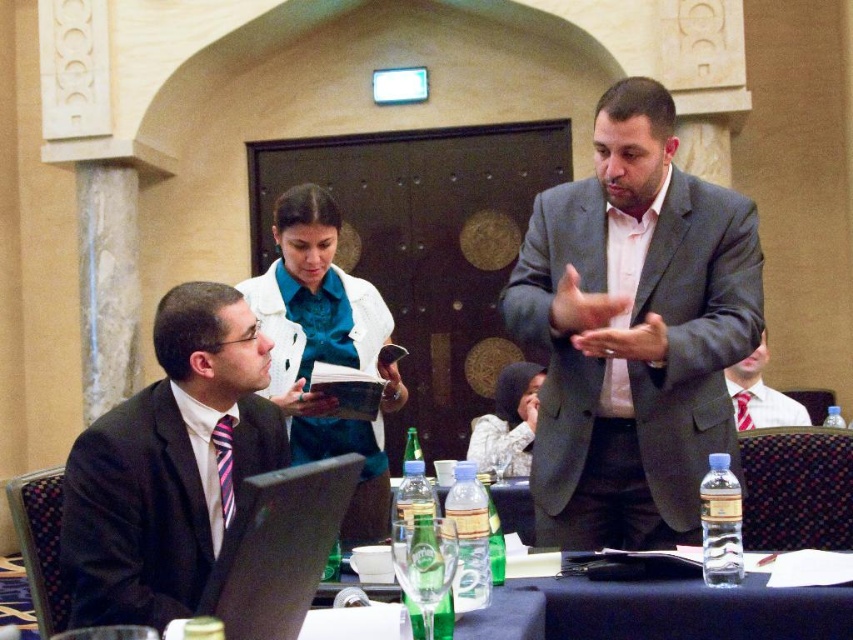
Which of these two, teal fabric book at center or matte gray suit at center, stands shorter?

With less height is matte gray suit at center.

Which is in front, point (283, 195) or point (733, 404)?

Point (283, 195) is more forward.

Who is more forward, (370, 362) or (761, 419)?

Point (370, 362) is in front.

I want to click on teal fabric book at center, so click(x=325, y=348).

Does point (367, 518) come closer to viewer compared to point (517, 392)?

That is True.

Does point (347, 289) come in front of point (526, 426)?

Yes.

Locate an element on the screen. teal fabric book at center is located at coordinates (325, 348).

Does clear plastic water at center have a lesser height compared to matte gray suit at center?

Correct, clear plastic water at center is not as tall as matte gray suit at center.

Is point (672, 624) positioned in front of point (801, 406)?

Yes, it is in front of point (801, 406).

Where is `clear plastic water at center`? The image size is (853, 640). clear plastic water at center is located at coordinates (689, 609).